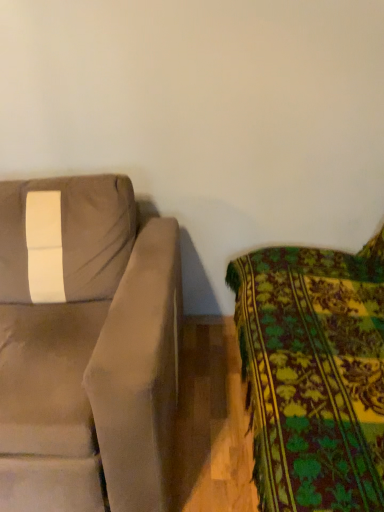
How much space does suede-like beige couch at left, which is counted as the 1th studio couch, starting from the left, occupy vertically?

35.16 inches.

You are a GUI agent. You are given a task and a screenshot of the screen. Output one action in this format:
    pyautogui.click(x=<x>, y=<y>)
    Task: Click on the suede-like beige couch at left, acting as the second studio couch starting from the right
    
    Given the screenshot: What is the action you would take?
    pyautogui.click(x=86, y=347)

The width and height of the screenshot is (384, 512). What do you see at coordinates (86, 347) in the screenshot?
I see `suede-like beige couch at left, acting as the second studio couch starting from the right` at bounding box center [86, 347].

At what (x,y) coordinates should I click in order to perform the action: click on floral fabric couch at right, which ranks as the 2th studio couch in left-to-right order. Please return your answer as a coordinate pair (x, y). Looking at the image, I should click on (314, 375).

What do you see at coordinates (314, 375) in the screenshot?
I see `floral fabric couch at right, which ranks as the 2th studio couch in left-to-right order` at bounding box center [314, 375].

Find the location of a particular element. Image resolution: width=384 pixels, height=512 pixels. suede-like beige couch at left, acting as the second studio couch starting from the right is located at coordinates (86, 347).

Would you say suede-like beige couch at left, acting as the second studio couch starting from the right, is to the left or to the right of floral fabric couch at right, the first studio couch when ordered from right to left, in the picture?

suede-like beige couch at left, acting as the second studio couch starting from the right, is positioned on floral fabric couch at right, the first studio couch when ordered from right to left,'s left side.

Which object is further away from the camera taking this photo, suede-like beige couch at left, which is counted as the 1th studio couch, starting from the left, or floral fabric couch at right, the first studio couch when ordered from right to left?

suede-like beige couch at left, which is counted as the 1th studio couch, starting from the left.

Does point (4, 187) come closer to viewer compared to point (362, 348)?

No, it is behind (362, 348).

From the image's perspective, is suede-like beige couch at left, which is counted as the 1th studio couch, starting from the left, positioned above or below floral fabric couch at right, the first studio couch when ordered from right to left?

Based on their image positions, suede-like beige couch at left, which is counted as the 1th studio couch, starting from the left, is located above floral fabric couch at right, the first studio couch when ordered from right to left.

From a real-world perspective, which object rests below the other?

From a 3D spatial view, suede-like beige couch at left, acting as the second studio couch starting from the right, is below.

In terms of width, does suede-like beige couch at left, acting as the second studio couch starting from the right, look wider or thinner when compared to floral fabric couch at right, which ranks as the 2th studio couch in left-to-right order?

Considering their sizes, suede-like beige couch at left, acting as the second studio couch starting from the right, looks broader than floral fabric couch at right, which ranks as the 2th studio couch in left-to-right order.

Is suede-like beige couch at left, acting as the second studio couch starting from the right, shorter than floral fabric couch at right, the first studio couch when ordered from right to left?

Yes, suede-like beige couch at left, acting as the second studio couch starting from the right, is shorter than floral fabric couch at right, the first studio couch when ordered from right to left.

Can you confirm if suede-like beige couch at left, acting as the second studio couch starting from the right, is smaller than floral fabric couch at right, the first studio couch when ordered from right to left?

Yes, suede-like beige couch at left, acting as the second studio couch starting from the right, is smaller than floral fabric couch at right, the first studio couch when ordered from right to left.

Is suede-like beige couch at left, which is counted as the 1th studio couch, starting from the left, surrounding floral fabric couch at right, the first studio couch when ordered from right to left?

No, floral fabric couch at right, the first studio couch when ordered from right to left, is not inside suede-like beige couch at left, which is counted as the 1th studio couch, starting from the left.

Is suede-like beige couch at left, which is counted as the 1th studio couch, starting from the left, beside floral fabric couch at right, the first studio couch when ordered from right to left?

suede-like beige couch at left, which is counted as the 1th studio couch, starting from the left, is not next to floral fabric couch at right, the first studio couch when ordered from right to left, and they're not touching.

Does suede-like beige couch at left, which is counted as the 1th studio couch, starting from the left, turn towards floral fabric couch at right, the first studio couch when ordered from right to left?

No, suede-like beige couch at left, which is counted as the 1th studio couch, starting from the left, does not turn towards floral fabric couch at right, the first studio couch when ordered from right to left.

How many degrees apart are the facing directions of suede-like beige couch at left, which is counted as the 1th studio couch, starting from the left, and floral fabric couch at right, the first studio couch when ordered from right to left?

The angle between the facing direction of suede-like beige couch at left, which is counted as the 1th studio couch, starting from the left, and the facing direction of floral fabric couch at right, the first studio couch when ordered from right to left, is 90 degrees.

How much distance is there between suede-like beige couch at left, acting as the second studio couch starting from the right, and floral fabric couch at right, which ranks as the 2th studio couch in left-to-right order?

A distance of 52.05 centimeters exists between suede-like beige couch at left, acting as the second studio couch starting from the right, and floral fabric couch at right, which ranks as the 2th studio couch in left-to-right order.

You are a GUI agent. You are given a task and a screenshot of the screen. Output one action in this format:
    pyautogui.click(x=<x>, y=<y>)
    Task: Click on the studio couch on the left of floral fabric couch at right, which ranks as the 2th studio couch in left-to-right order
    
    Given the screenshot: What is the action you would take?
    pyautogui.click(x=86, y=347)

Is floral fabric couch at right, the first studio couch when ordered from right to left, at the left side of suede-like beige couch at left, acting as the second studio couch starting from the right?

Incorrect, floral fabric couch at right, the first studio couch when ordered from right to left, is not on the left side of suede-like beige couch at left, acting as the second studio couch starting from the right.

Is floral fabric couch at right, the first studio couch when ordered from right to left, in front of or behind suede-like beige couch at left, acting as the second studio couch starting from the right, in the image?

floral fabric couch at right, the first studio couch when ordered from right to left, is positioned closer to the viewer than suede-like beige couch at left, acting as the second studio couch starting from the right.

Is point (250, 409) closer or farther from the camera than point (153, 500)?

Point (250, 409) is farther from the camera than point (153, 500).

From the image's perspective, is floral fabric couch at right, the first studio couch when ordered from right to left, above or below suede-like beige couch at left, acting as the second studio couch starting from the right?

From the image's perspective, floral fabric couch at right, the first studio couch when ordered from right to left, appears below suede-like beige couch at left, acting as the second studio couch starting from the right.

From a real-world perspective, is floral fabric couch at right, the first studio couch when ordered from right to left, located higher than suede-like beige couch at left, acting as the second studio couch starting from the right?

Yes.

Between floral fabric couch at right, which ranks as the 2th studio couch in left-to-right order, and suede-like beige couch at left, acting as the second studio couch starting from the right, which one has smaller width?

floral fabric couch at right, which ranks as the 2th studio couch in left-to-right order, is thinner.

Considering the relative sizes of floral fabric couch at right, which ranks as the 2th studio couch in left-to-right order, and suede-like beige couch at left, which is counted as the 1th studio couch, starting from the left, in the image provided, is floral fabric couch at right, which ranks as the 2th studio couch in left-to-right order, shorter than suede-like beige couch at left, which is counted as the 1th studio couch, starting from the left,?

Incorrect, the height of floral fabric couch at right, which ranks as the 2th studio couch in left-to-right order, does not fall short of that of suede-like beige couch at left, which is counted as the 1th studio couch, starting from the left.

Between floral fabric couch at right, the first studio couch when ordered from right to left, and suede-like beige couch at left, which is counted as the 1th studio couch, starting from the left, which one has larger size?

Bigger between the two is floral fabric couch at right, the first studio couch when ordered from right to left.

From the picture: Is floral fabric couch at right, which ranks as the 2th studio couch in left-to-right order, surrounding suede-like beige couch at left, acting as the second studio couch starting from the right?

Actually, suede-like beige couch at left, acting as the second studio couch starting from the right, is outside floral fabric couch at right, which ranks as the 2th studio couch in left-to-right order.

Is floral fabric couch at right, which ranks as the 2th studio couch in left-to-right order, touching suede-like beige couch at left, which is counted as the 1th studio couch, starting from the left?

floral fabric couch at right, which ranks as the 2th studio couch in left-to-right order, and suede-like beige couch at left, which is counted as the 1th studio couch, starting from the left, are not in contact.

Is floral fabric couch at right, which ranks as the 2th studio couch in left-to-right order, facing away from suede-like beige couch at left, acting as the second studio couch starting from the right?

floral fabric couch at right, which ranks as the 2th studio couch in left-to-right order, is not turned away from suede-like beige couch at left, acting as the second studio couch starting from the right.

What's the angular difference between floral fabric couch at right, the first studio couch when ordered from right to left, and suede-like beige couch at left, which is counted as the 1th studio couch, starting from the left,'s facing directions?

They differ by 90 degrees in their facing directions.

How far apart are floral fabric couch at right, the first studio couch when ordered from right to left, and suede-like beige couch at left, acting as the second studio couch starting from the right?

They are 20.49 inches apart.

This screenshot has height=512, width=384. Find the location of `studio couch below the floral fabric couch at right, the first studio couch when ordered from right to left (from a real-world perspective)`. studio couch below the floral fabric couch at right, the first studio couch when ordered from right to left (from a real-world perspective) is located at coordinates (86, 347).

Image resolution: width=384 pixels, height=512 pixels. I want to click on studio couch lying above the floral fabric couch at right, which ranks as the 2th studio couch in left-to-right order (from the image's perspective), so click(86, 347).

Identify the location of studio couch in front of the suede-like beige couch at left, acting as the second studio couch starting from the right. (314, 375).